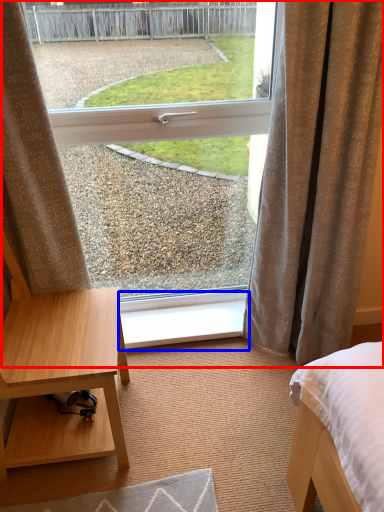
Question: Which point is further to the camera, window (highlighted by a red box) or window sill (highlighted by a blue box)?

Choices:
 (A) window
 (B) window sill

Answer: (B)